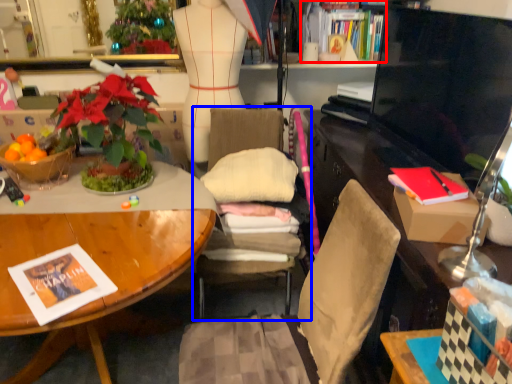
Question: Which object is closer to the camera taking this photo, book (highlighted by a red box) or chair (highlighted by a blue box)?

Choices:
 (A) book
 (B) chair

Answer: (B)